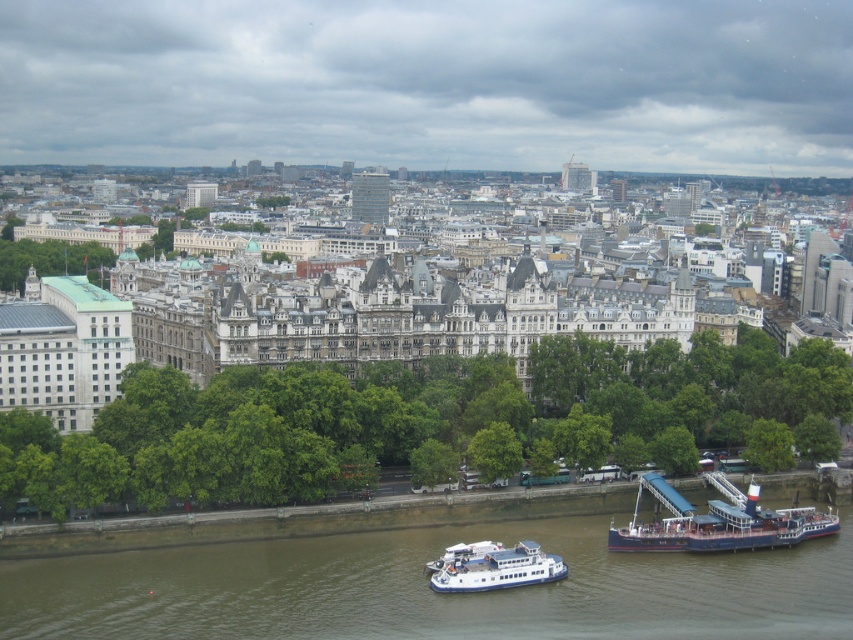
Question: Is brown water at lower center to the right of green leafy tree at left from the viewer's perspective?

Choices:
 (A) yes
 (B) no

Answer: (A)

Question: Estimate the real-world distances between objects in this image. Which object is closer to the brown water at lower center?

Choices:
 (A) green leafy trees at center
 (B) green leafy tree at left
 (C) green leafy tree at center
 (D) white glossy ferry at lower center

Answer: (D)

Question: Which point appears farthest from the camera in this image?

Choices:
 (A) (35, 468)
 (B) (514, 579)
 (C) (1, 257)
 (D) (711, 500)

Answer: (C)

Question: Is brown water at lower center thinner than blue polished wood boat at lower right?

Choices:
 (A) yes
 (B) no

Answer: (B)

Question: Is brown water at lower center bigger than blue polished wood boat at lower right?

Choices:
 (A) yes
 (B) no

Answer: (A)

Question: Which of the following is the farthest from the observer?

Choices:
 (A) brown water at lower center
 (B) green leafy trees at center

Answer: (B)